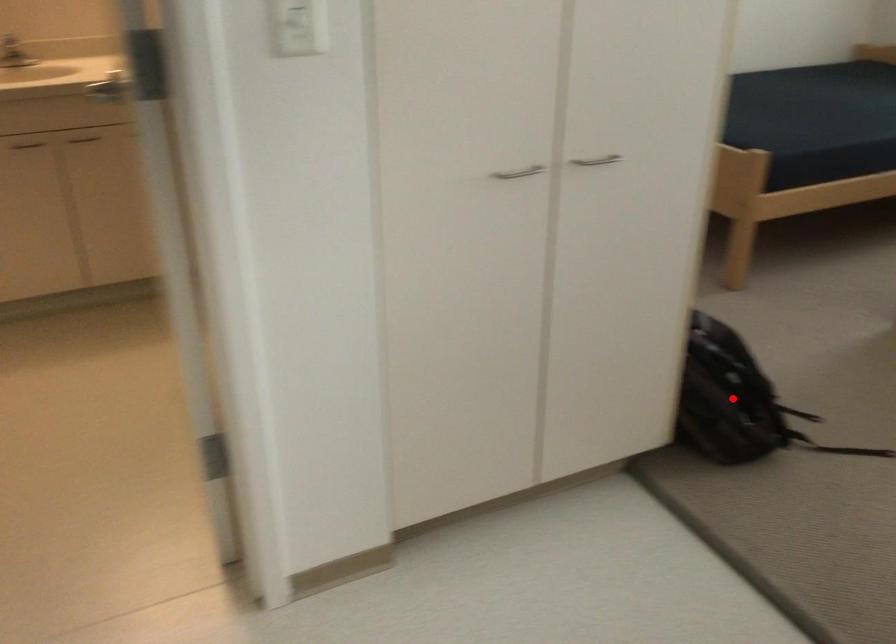
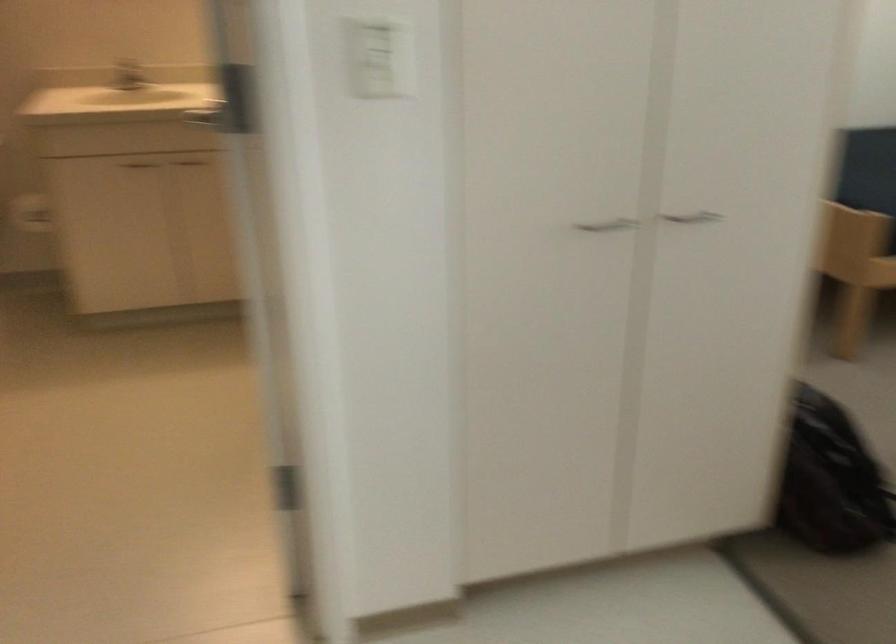
Locate, in the second image, the point that corresponds to the highlighted location in the first image.

(831, 480)